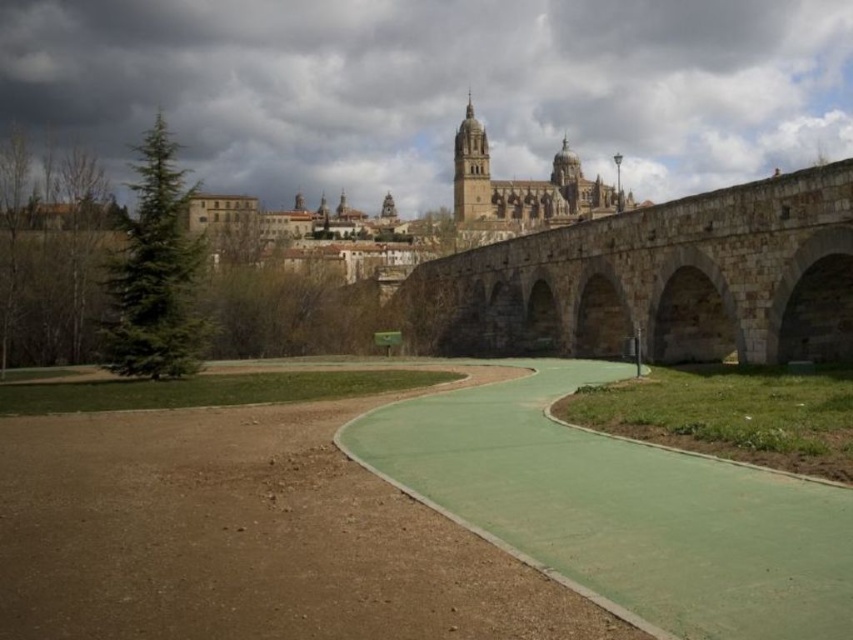
In the scene shown: Is matte stone bridge at center behind stone arch bridge at center?

That is True.

Does matte stone bridge at center appear under stone arch bridge at center?

No, matte stone bridge at center is not below stone arch bridge at center.

Is point (282, 83) more distant than point (749, 284)?

Yes, it is.

At what (x,y) coordinates should I click in order to perform the action: click on matte stone bridge at center. Please return your answer as a coordinate pair (x, y). Looking at the image, I should click on (434, 88).

Based on the photo, is matte stone bridge at center below green concrete path at center?

Actually, matte stone bridge at center is above green concrete path at center.

Does matte stone bridge at center lie in front of green concrete path at center?

No, matte stone bridge at center is behind green concrete path at center.

Which is in front, point (735, 56) or point (444, 493)?

Positioned in front is point (444, 493).

Find the location of a particular element. matte stone bridge at center is located at coordinates (434, 88).

Between green concrete path at center and stone arch bridge at center, which one is positioned higher?

stone arch bridge at center is above.

Can you confirm if green concrete path at center is bigger than stone arch bridge at center?

No.

Measure the distance between point (378,410) and camera.

They are 37.38 meters apart.

Where is `green concrete path at center`? This screenshot has width=853, height=640. green concrete path at center is located at coordinates (619, 509).